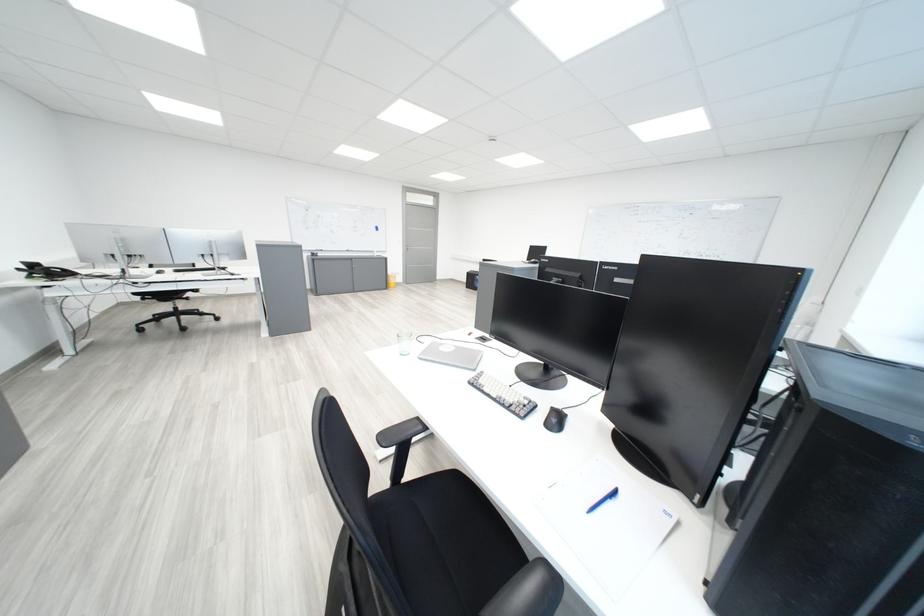
Locate an element on the screen. black chair sitting surface is located at coordinates (441, 543).